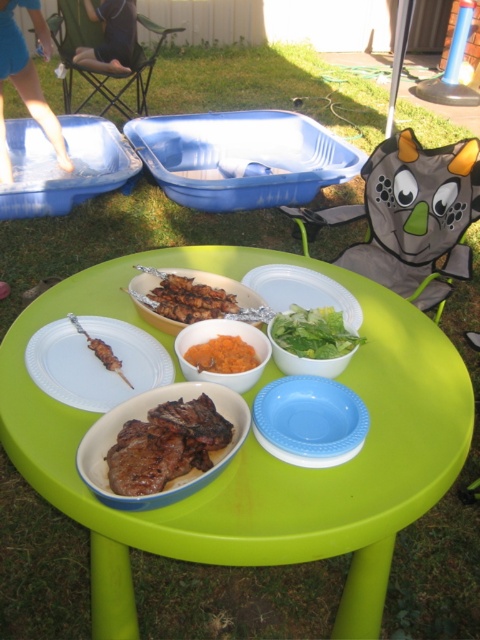
Is green plastic table at center positioned at the back of green matte salad bowl at center?

No, green plastic table at center is closer to the viewer.

Who is lower down, green plastic table at center or green matte salad bowl at center?

green plastic table at center is lower down.

The width and height of the screenshot is (480, 640). What are the coordinates of `green plastic table at center` in the screenshot? It's located at (257, 451).

Locate an element on the screen. The width and height of the screenshot is (480, 640). green plastic table at center is located at coordinates (257, 451).

Who is lower down, green plastic table at center or brown matte skewers at center?

Positioned lower is green plastic table at center.

Can you confirm if green plastic table at center is bigger than brown matte skewers at center?

Correct, green plastic table at center is larger in size than brown matte skewers at center.

This screenshot has width=480, height=640. What do you see at coordinates (257, 451) in the screenshot?
I see `green plastic table at center` at bounding box center [257, 451].

At what (x,y) coordinates should I click in order to perform the action: click on green plastic table at center. Please return your answer as a coordinate pair (x, y). Looking at the image, I should click on click(x=257, y=451).

Which is behind, point (113, 273) or point (255, 324)?

The point (113, 273) is more distant.

Between green plastic table at center and matte yellow bowl at center, which one is positioned lower?

Positioned lower is green plastic table at center.

Measure the distance between green plastic table at center and camera.

green plastic table at center is 32.04 inches from camera.

The height and width of the screenshot is (640, 480). I want to click on green plastic table at center, so click(x=257, y=451).